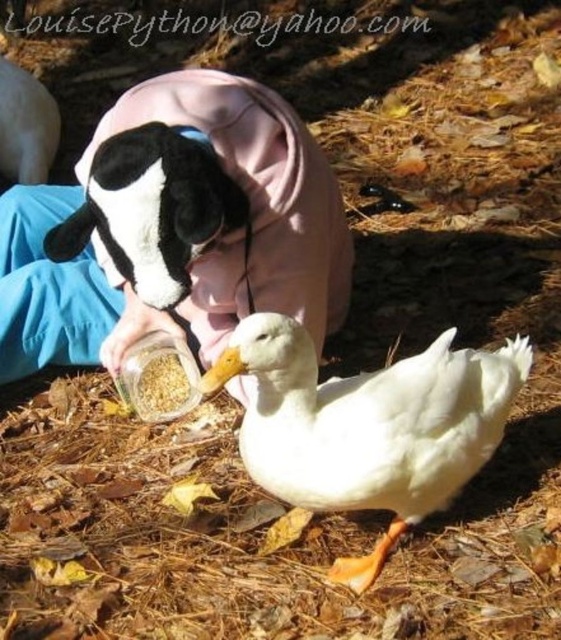
Question: Which point is closer to the camera taking this photo?

Choices:
 (A) (157, 257)
 (B) (15, 96)

Answer: (A)

Question: Which point is farther to the camera?

Choices:
 (A) (332, 275)
 (B) (52, 125)

Answer: (B)

Question: Considering the relative positions of soft plush toy at center and black plush toy at upper left in the image provided, where is soft plush toy at center located with respect to black plush toy at upper left?

Choices:
 (A) right
 (B) left

Answer: (A)

Question: Where is pink fleece jacket at center located in relation to soft plush toy at center in the image?

Choices:
 (A) below
 (B) above

Answer: (B)

Question: Does pink fleece jacket at center have a greater width compared to black plush toy at upper left?

Choices:
 (A) no
 (B) yes

Answer: (B)

Question: Which point is closer to the camera?

Choices:
 (A) soft plush toy at center
 (B) black plush toy at upper left

Answer: (A)